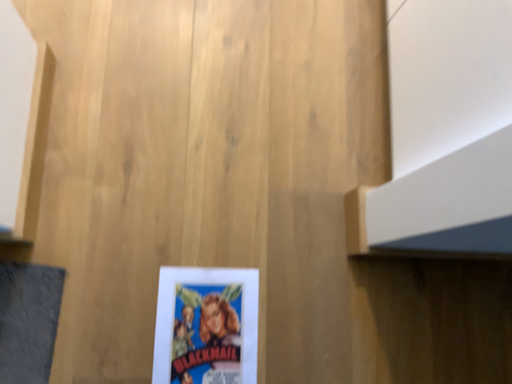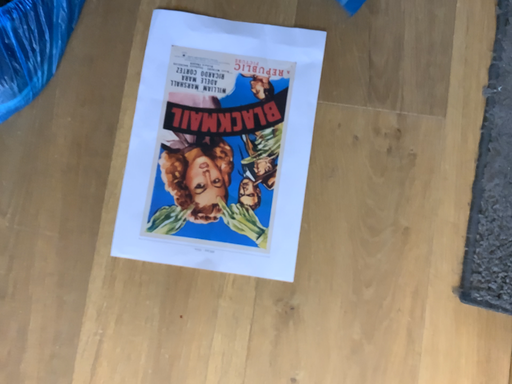
Question: Which way did the camera rotate in the video?

Choices:
 (A) rotated left
 (B) rotated right

Answer: (B)